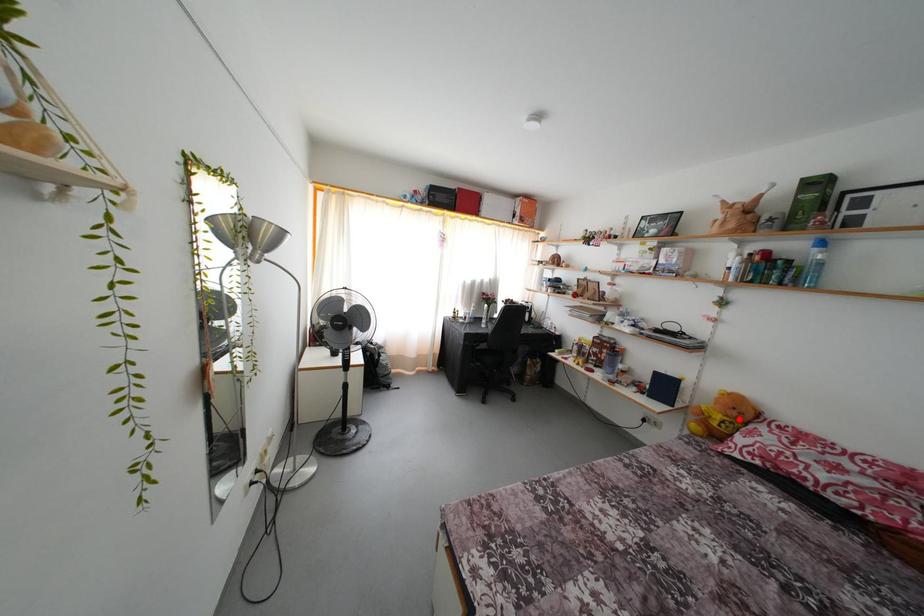
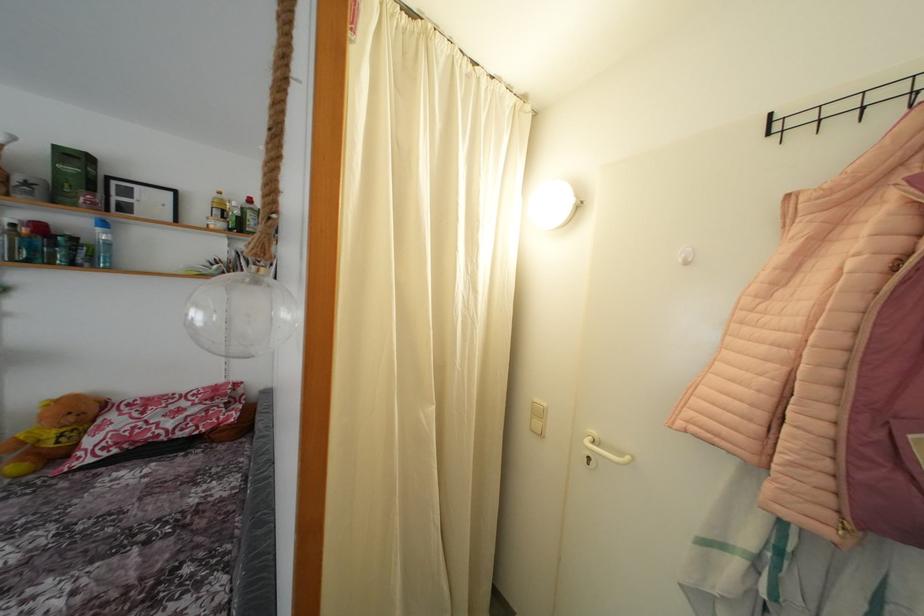
Find the pixel in the second image that matches the highlighted location in the first image.

(77, 424)